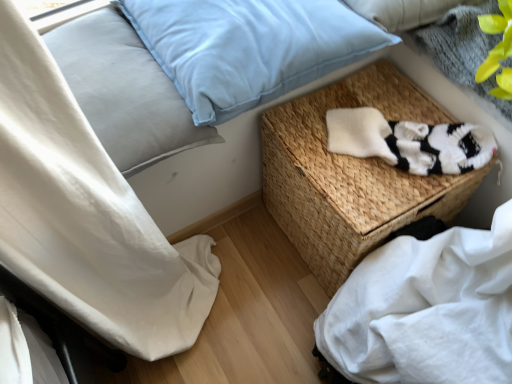
Question: Is woven wicker basket at center looking in the opposite direction of light blue fabric pillow at upper left, which is the 2th pillow from right to left?

Choices:
 (A) no
 (B) yes

Answer: (A)

Question: Is woven wicker basket at center far from light blue fabric pillow at upper left, which is the first pillow in left-to-right order?

Choices:
 (A) yes
 (B) no

Answer: (B)

Question: Does woven wicker basket at center have a lesser height compared to light blue fabric pillow at upper left, which is the first pillow in left-to-right order?

Choices:
 (A) no
 (B) yes

Answer: (A)

Question: Is woven wicker basket at center with light blue fabric pillow at upper left, which is the 2th pillow from right to left?

Choices:
 (A) no
 (B) yes

Answer: (A)

Question: Is woven wicker basket at center taller than light blue fabric pillow at upper left, which is the first pillow in left-to-right order?

Choices:
 (A) no
 (B) yes

Answer: (B)

Question: Visually, is light blue velvety pillow at upper center, the second pillow from the left, positioned to the left or to the right of white cotton sheet at lower right?

Choices:
 (A) right
 (B) left

Answer: (B)

Question: Does point (380, 36) appear closer or farther from the camera than point (393, 289)?

Choices:
 (A) closer
 (B) farther

Answer: (B)

Question: Which is correct: light blue velvety pillow at upper center, the first pillow in the right-to-left sequence, is inside white cotton sheet at lower right, or outside of it?

Choices:
 (A) inside
 (B) outside

Answer: (B)

Question: Looking at the image, does light blue velvety pillow at upper center, the first pillow in the right-to-left sequence, seem bigger or smaller compared to white cotton sheet at lower right?

Choices:
 (A) small
 (B) big

Answer: (A)

Question: Visually, is light blue fabric pillow at upper left, which is the first pillow in left-to-right order, positioned to the left or to the right of light blue velvety pillow at upper center, the first pillow in the right-to-left sequence?

Choices:
 (A) right
 (B) left

Answer: (B)

Question: Is point (80, 51) positioned closer to the camera than point (262, 87)?

Choices:
 (A) closer
 (B) farther

Answer: (B)

Question: In terms of height, does light blue fabric pillow at upper left, which is the 2th pillow from right to left, look taller or shorter compared to light blue velvety pillow at upper center, the second pillow from the left?

Choices:
 (A) short
 (B) tall

Answer: (B)

Question: Looking at their shapes, would you say light blue fabric pillow at upper left, which is the first pillow in left-to-right order, is wider or thinner than light blue velvety pillow at upper center, the first pillow in the right-to-left sequence?

Choices:
 (A) wide
 (B) thin

Answer: (B)

Question: In terms of size, does white knitted socks at center-right appear bigger or smaller than light blue fabric pillow at upper left, which is the 2th pillow from right to left?

Choices:
 (A) small
 (B) big

Answer: (A)

Question: From a real-world perspective, is white knitted socks at center-right above or below light blue fabric pillow at upper left, which is the first pillow in left-to-right order?

Choices:
 (A) below
 (B) above

Answer: (A)